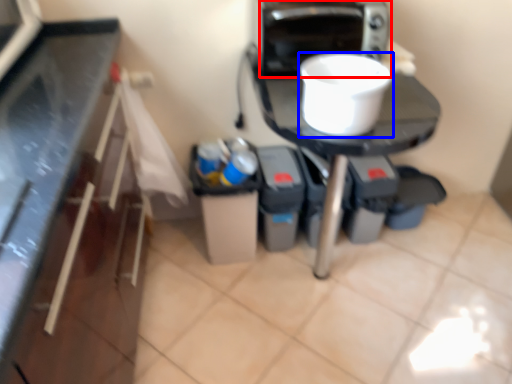
Question: Among these objects, which one is farthest to the camera, home appliance (highlighted by a red box) or kitchen appliance (highlighted by a blue box)?

Choices:
 (A) home appliance
 (B) kitchen appliance

Answer: (A)